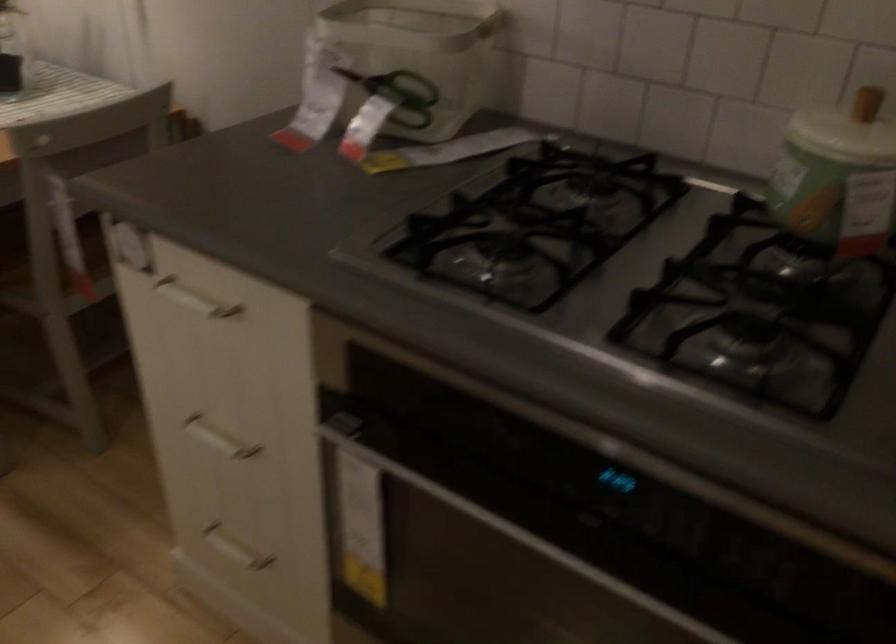
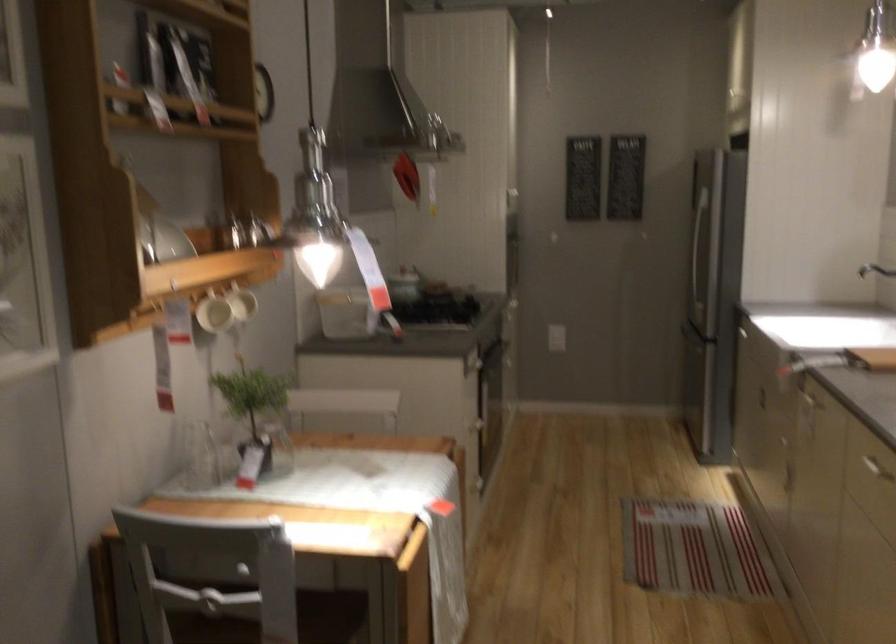
Question: I am providing you with two images of the same scene from different viewpoints. After the viewpoint changes to image2, which objects are now occluded?

Choices:
 (A) black tape roll
 (B) cabinet drawer handle
 (C) jar lid knob
 (D) sink faucet handle

Answer: (C)